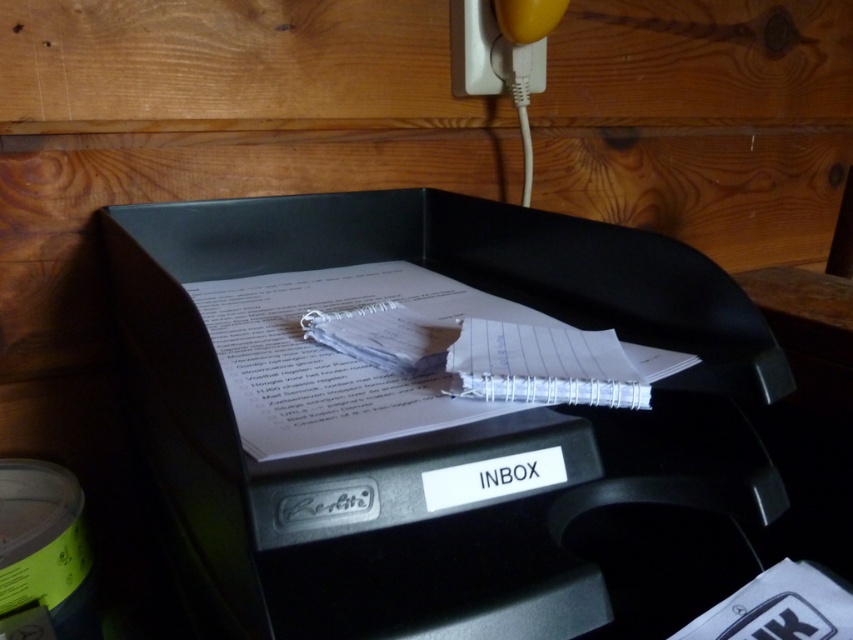
How much distance is there between black plastic inbox at center and yellow rubber at upper right?

They are 37.55 centimeters apart.

Who is positioned more to the right, black plastic inbox at center or yellow rubber at upper right?

Positioned to the right is yellow rubber at upper right.

I want to click on black plastic inbox at center, so click(439, 429).

Is black plastic inbox at center below white lined paper at center?

Yes, black plastic inbox at center is below white lined paper at center.

Can you confirm if black plastic inbox at center is positioned to the left of white lined paper at center?

Incorrect, black plastic inbox at center is not on the left side of white lined paper at center.

Image resolution: width=853 pixels, height=640 pixels. I want to click on black plastic inbox at center, so click(439, 429).

In order to click on black plastic inbox at center in this screenshot , I will do `click(439, 429)`.

Does white lined paper at center have a smaller size compared to yellow rubber at upper right?

Incorrect, white lined paper at center is not smaller in size than yellow rubber at upper right.

Does white lined paper at center have a lesser height compared to yellow rubber at upper right?

No.

Measure the distance between point (479, 296) and camera.

The distance of point (479, 296) from camera is 62.82 centimeters.

Find the location of a particular element. white lined paper at center is located at coordinates tap(334, 356).